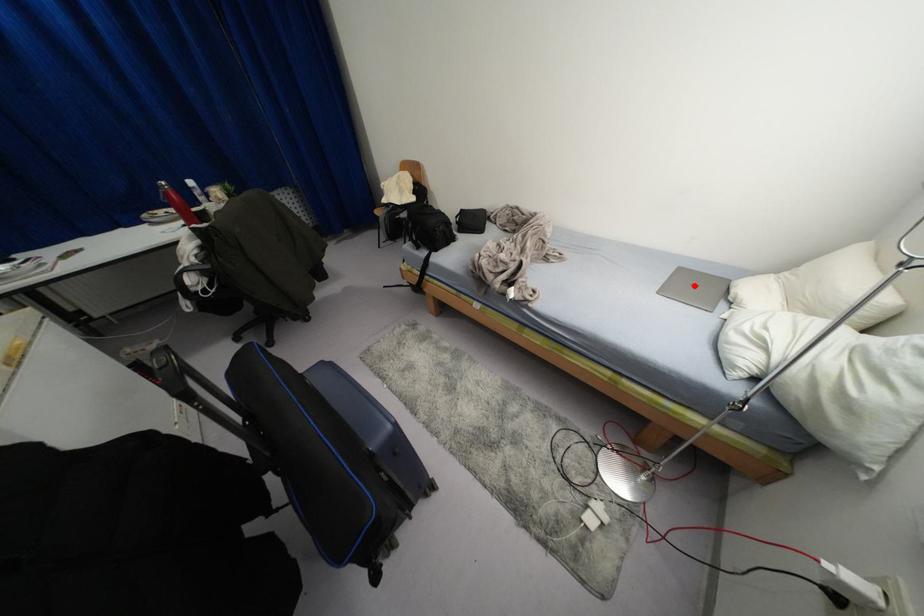
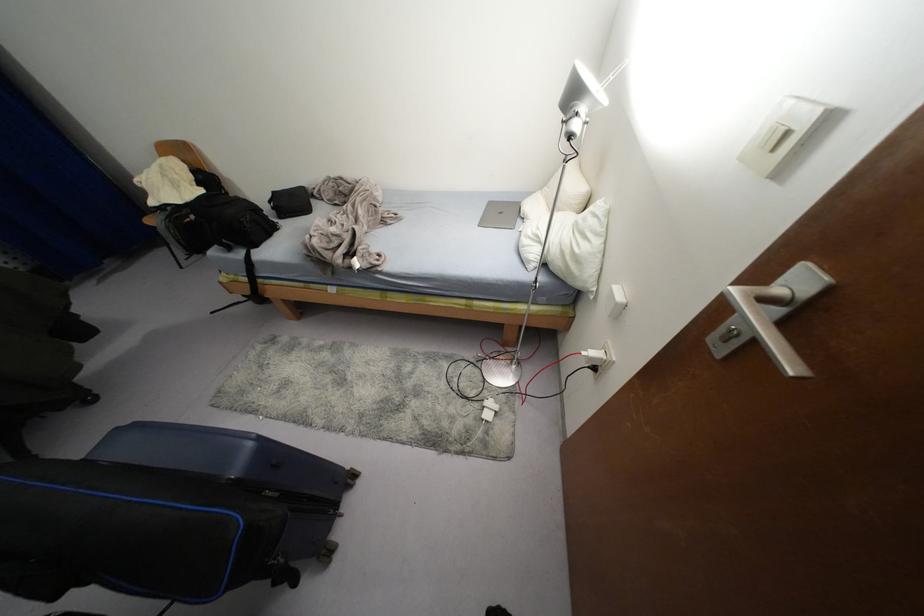
In the second image, find the point that corresponds to the highlighted location in the first image.

(500, 213)